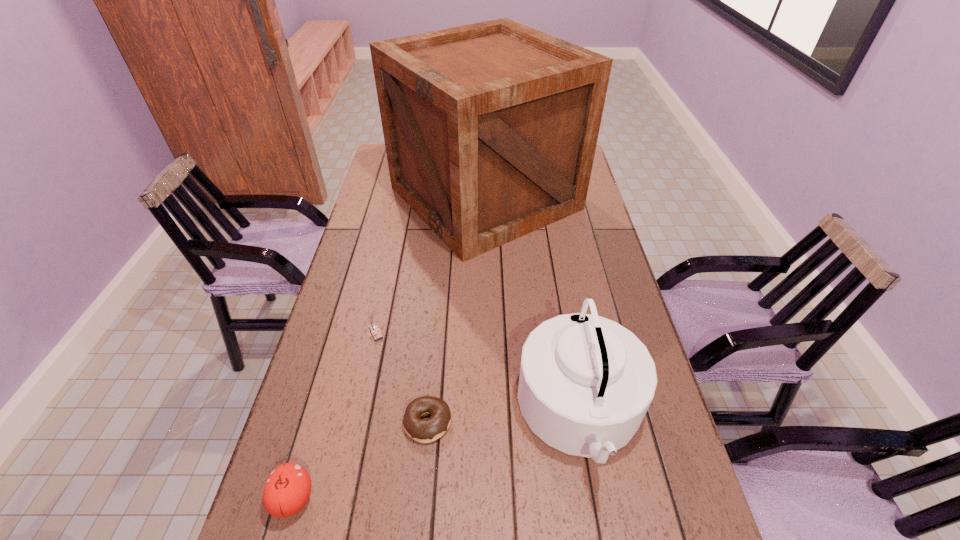
Locate an element on the screen. This screenshot has width=960, height=540. free region that satisfies the following two spatial constraints: 1. on the back side of the apple; 2. on the left side of the fourth nearest object is located at coordinates (341, 333).